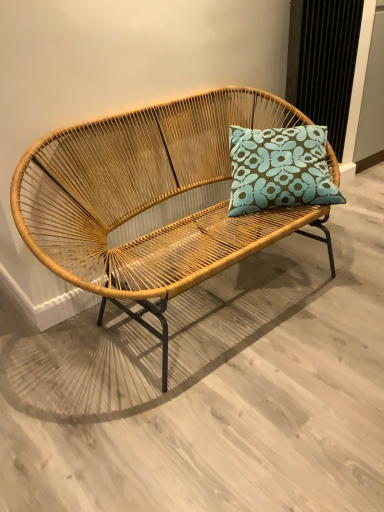
Question: Should I look upward or downward to see teal floral cushion at center?

Choices:
 (A) up
 (B) down

Answer: (A)

Question: From a real-world perspective, does teal floral cushion at center sit lower than natural woven studio couch at center?

Choices:
 (A) no
 (B) yes

Answer: (A)

Question: Is teal floral cushion at center in front of natural woven studio couch at center?

Choices:
 (A) no
 (B) yes

Answer: (A)

Question: Are teal floral cushion at center and natural woven studio couch at center far apart?

Choices:
 (A) no
 (B) yes

Answer: (A)

Question: Does teal floral cushion at center have a greater height compared to natural woven studio couch at center?

Choices:
 (A) no
 (B) yes

Answer: (A)

Question: Does teal floral cushion at center have a smaller size compared to natural woven studio couch at center?

Choices:
 (A) no
 (B) yes

Answer: (B)

Question: Considering the relative sizes of teal floral cushion at center and natural woven studio couch at center in the image provided, is teal floral cushion at center bigger than natural woven studio couch at center?

Choices:
 (A) yes
 (B) no

Answer: (B)

Question: Is natural woven studio couch at center bigger than teal floral cushion at center?

Choices:
 (A) yes
 (B) no

Answer: (A)

Question: Is natural woven studio couch at center further to camera compared to teal floral cushion at center?

Choices:
 (A) no
 (B) yes

Answer: (A)

Question: Is natural woven studio couch at center next to teal floral cushion at center and touching it?

Choices:
 (A) yes
 (B) no

Answer: (B)

Question: Does natural woven studio couch at center have a greater width compared to teal floral cushion at center?

Choices:
 (A) yes
 (B) no

Answer: (A)

Question: Considering the relative positions of natural woven studio couch at center and teal floral cushion at center in the image provided, is natural woven studio couch at center to the left of teal floral cushion at center from the viewer's perspective?

Choices:
 (A) no
 (B) yes

Answer: (B)

Question: Does natural woven studio couch at center have a greater height compared to teal floral cushion at center?

Choices:
 (A) no
 (B) yes

Answer: (B)

Question: Is point (312, 172) positioned closer to the camera than point (225, 263)?

Choices:
 (A) farther
 (B) closer

Answer: (A)